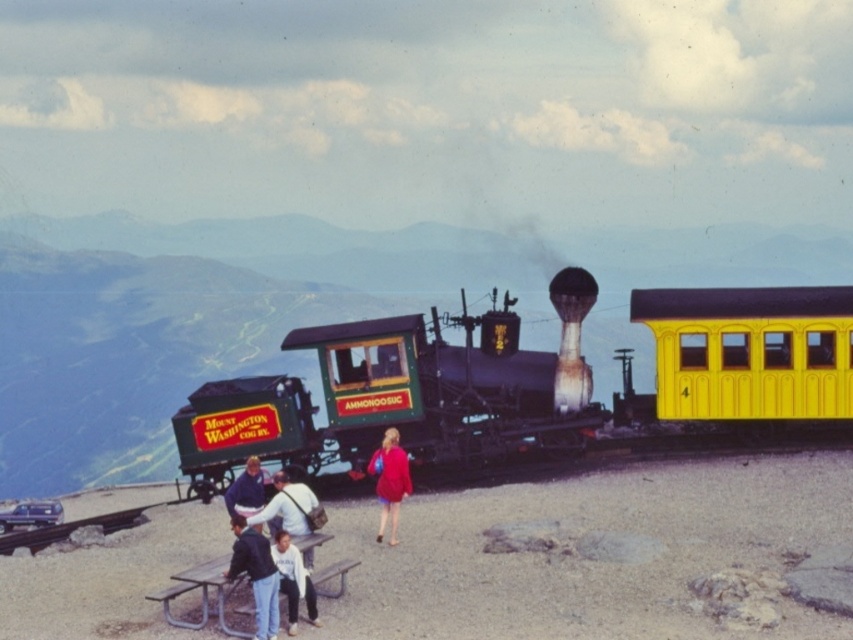
Which of these two, matte red dress at center or white cotton shirt at center, stands shorter?

Standing shorter between the two is white cotton shirt at center.

Between matte red dress at center and white cotton shirt at center, which one appears on the left side from the viewer's perspective?

white cotton shirt at center

Who is more forward, (390, 516) or (299, 592)?

Point (299, 592) is in front.

In order to click on matte red dress at center in this screenshot , I will do `click(390, 481)`.

How distant is dark blue denim jacket at lower left from matte red dress at center?

dark blue denim jacket at lower left is 3.93 meters away from matte red dress at center.

Is point (271, 596) in front of point (387, 484)?

Yes, it is in front of point (387, 484).

The width and height of the screenshot is (853, 640). In order to click on dark blue denim jacket at lower left in this screenshot , I will do `click(256, 573)`.

Between point (299, 532) and point (236, 496), which one is positioned behind?

The point (236, 496) is behind.

Does denim jacket at lower center have a greater height compared to dark blue sweater at center?

Yes.

Describe the element at coordinates (287, 508) in the screenshot. The image size is (853, 640). I see `denim jacket at lower center` at that location.

The height and width of the screenshot is (640, 853). Find the location of `denim jacket at lower center`. denim jacket at lower center is located at coordinates (287, 508).